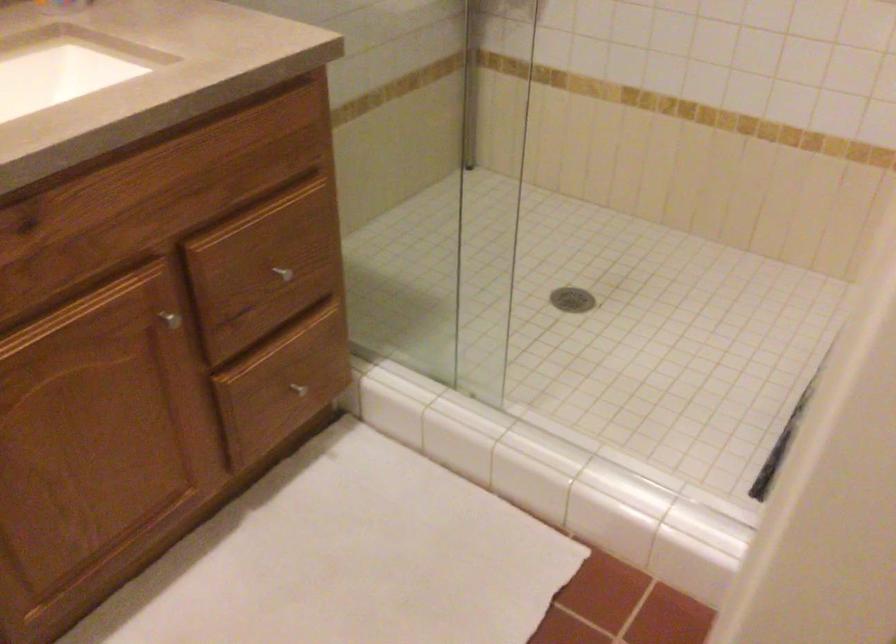
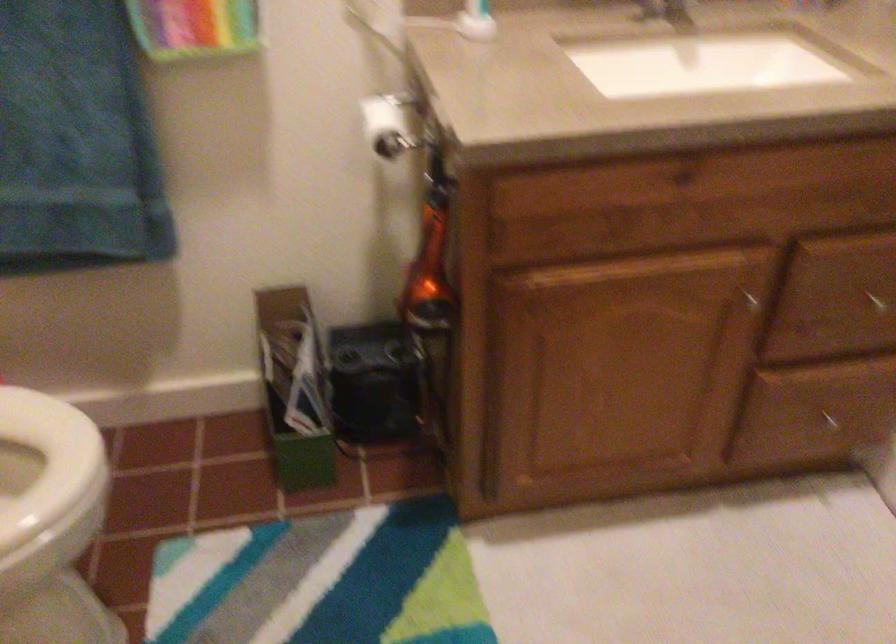
Locate, in the second image, the point that corresponds to (x=282, y=269) in the first image.

(875, 301)